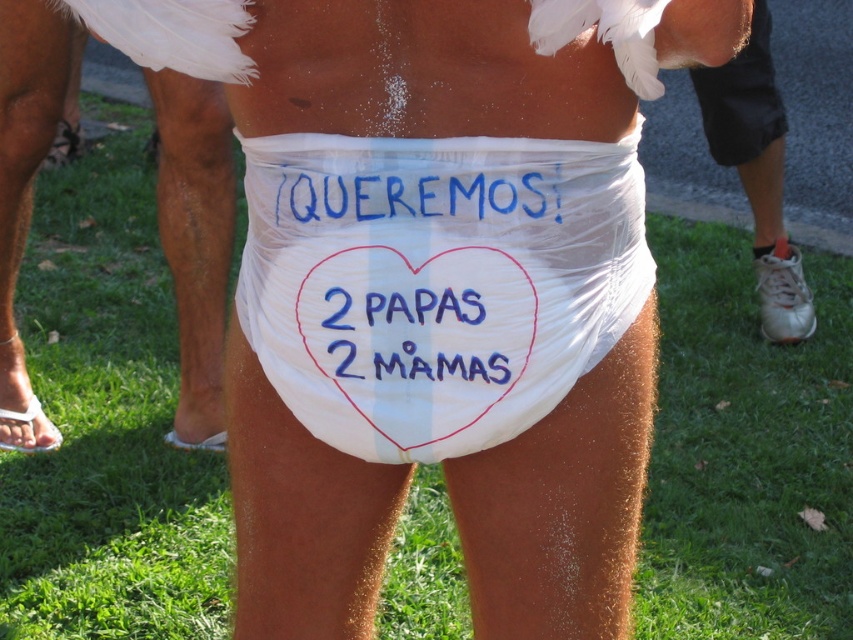
Between blue ink text at center and blue fabric sign at upper center, which one is positioned higher?

blue fabric sign at upper center is higher up.

Is blue ink text at center to the right of blue fabric sign at upper center from the viewer's perspective?

Correct, you'll find blue ink text at center to the right of blue fabric sign at upper center.

Does point (352, 333) come closer to viewer compared to point (491, 172)?

That is False.

Find the location of a particular element. This screenshot has height=640, width=853. blue ink text at center is located at coordinates (421, 336).

Measure the distance from white cloth diaper at lower center to white leather shoe at right.

1.82 meters

Can you confirm if white cloth diaper at lower center is bigger than white leather shoe at right?

Incorrect, white cloth diaper at lower center is not larger than white leather shoe at right.

Where is `white cloth diaper at lower center`? white cloth diaper at lower center is located at coordinates (195, 237).

Is point (262, 317) positioned in front of point (213, 252)?

Yes, it is.

In the scene shown: Can you confirm if white plastic diaper at center is positioned below white cloth diaper at lower center?

Correct, white plastic diaper at center is located below white cloth diaper at lower center.

Is point (286, 280) more distant than point (209, 296)?

No, (286, 280) is closer to viewer.

This screenshot has height=640, width=853. Identify the location of white plastic diaper at center. (436, 282).